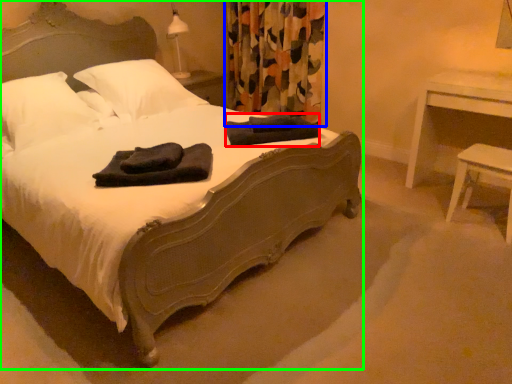
Question: Which is farther away from material (highlighted by a red box)? curtain (highlighted by a blue box) or bed (highlighted by a green box)?

Choices:
 (A) curtain
 (B) bed

Answer: (A)